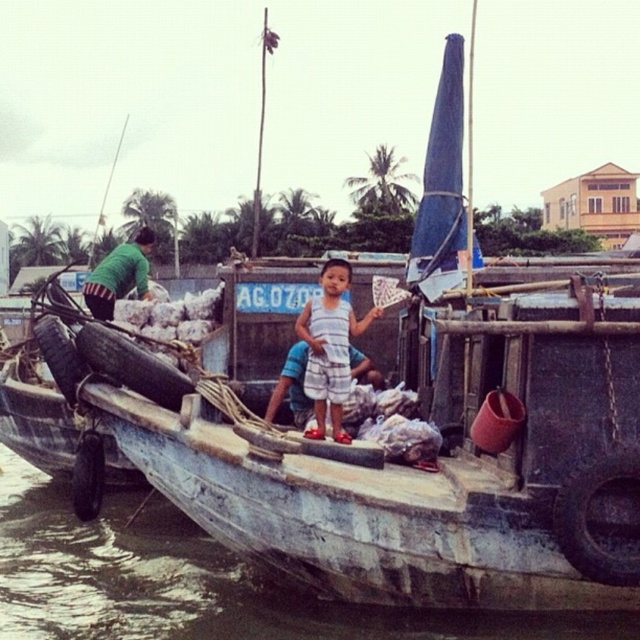
You are a tourist standing on the riverbank and want to take a photo of the smooth concrete boat at center and the green fabric shirt at left. Which object should you focus on first to ensure both are in frame?

The smooth concrete boat at center is positioned under the green fabric shirt at left, so you should focus on the green fabric shirt at left first to ensure both are in frame.

You are a tourist standing on the riverbank and want to take a photo of the striped shorts at center and the smooth concrete boat at center. Which object should you point your camera towards first if you want to capture both in one shot?

You should point your camera towards the smooth concrete boat at center first since it is to the left of the striped shorts at center, allowing both objects to be captured in the frame when positioned correctly.